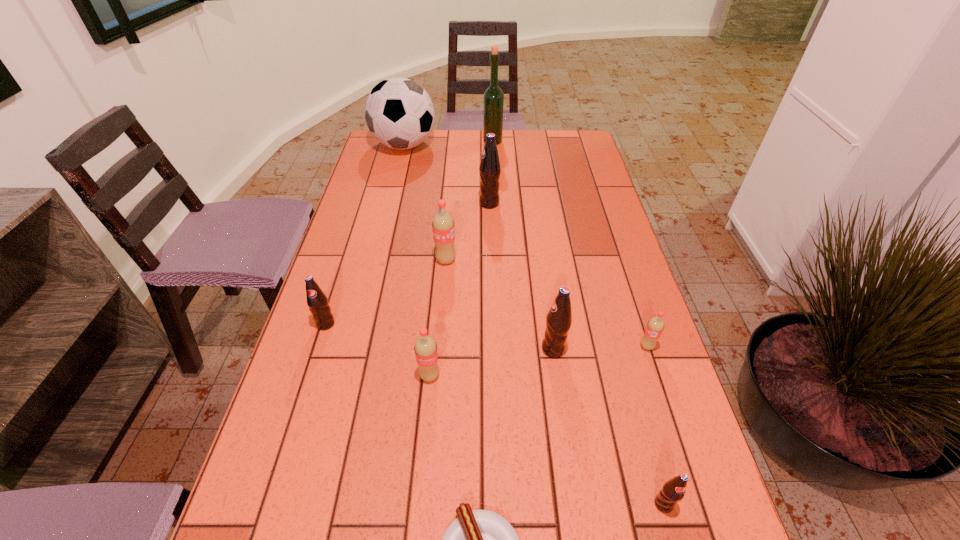
Image resolution: width=960 pixels, height=540 pixels. Find the location of `vacant space located 0.140m on the front label of the third farthest object`. vacant space located 0.140m on the front label of the third farthest object is located at coordinates tap(435, 204).

I want to click on vacant space located 0.310m on the front label of the third farthest object, so click(x=381, y=204).

Locate an element on the screen. This screenshot has width=960, height=540. vacant space located 0.140m on the back of the second farthest pop is located at coordinates (449, 222).

Find the location of a particular element. Image resolution: width=960 pixels, height=540 pixels. free space located 0.200m on the front label of the third black pop from left to right is located at coordinates (453, 349).

The image size is (960, 540). Find the location of `vacant area located on the front label of the third black pop from left to right`. vacant area located on the front label of the third black pop from left to right is located at coordinates (392, 349).

Find the location of a particular element. Image resolution: width=960 pixels, height=540 pixels. free space located on the front label of the third black pop from left to right is located at coordinates tap(426, 349).

Find the location of a particular element. This screenshot has height=540, width=960. free location located on the front label of the sixth nearest object is located at coordinates (285, 453).

The image size is (960, 540). I want to click on vacant space located on the front of the second biggest red soda, so click(416, 526).

Locate an element on the screen. free region located on the left of the second nearest red soda is located at coordinates (547, 346).

You are a GUI agent. You are given a task and a screenshot of the screen. Output one action in this format:
    pyautogui.click(x=<x>, y=<y>)
    Task: Click on the liquor that is at the far edge
    
    Given the screenshot: What is the action you would take?
    pyautogui.click(x=493, y=96)